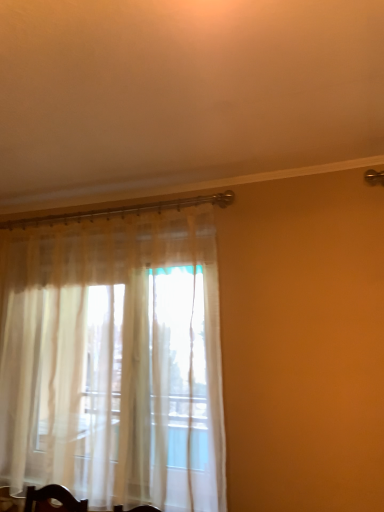
This screenshot has width=384, height=512. What do you see at coordinates (114, 360) in the screenshot?
I see `sheer white curtain at left` at bounding box center [114, 360].

The width and height of the screenshot is (384, 512). Find the location of `sheer white curtain at left`. sheer white curtain at left is located at coordinates (114, 360).

Locate an element on the screen. This screenshot has width=384, height=512. sheer white curtain at left is located at coordinates (114, 360).